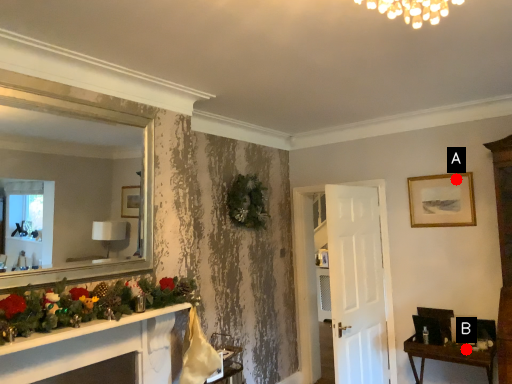
Question: Two points are circled on the image, labeled by A and B beside each circle. Which point appears farthest from the camera in this image?

Choices:
 (A) A is further
 (B) B is further

Answer: (A)